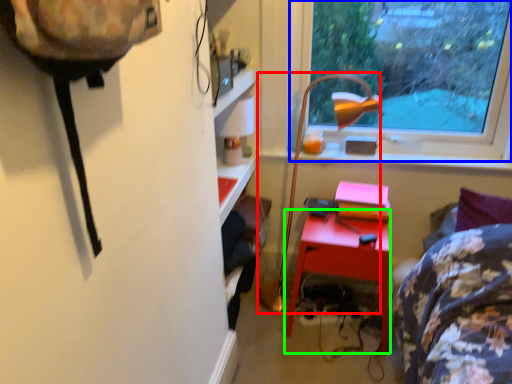
Question: Based on their relative distances, which object is farther from lamp (highlighted by a red box)? Choose from window (highlighted by a blue box) and desk (highlighted by a green box).

Choices:
 (A) window
 (B) desk

Answer: (A)